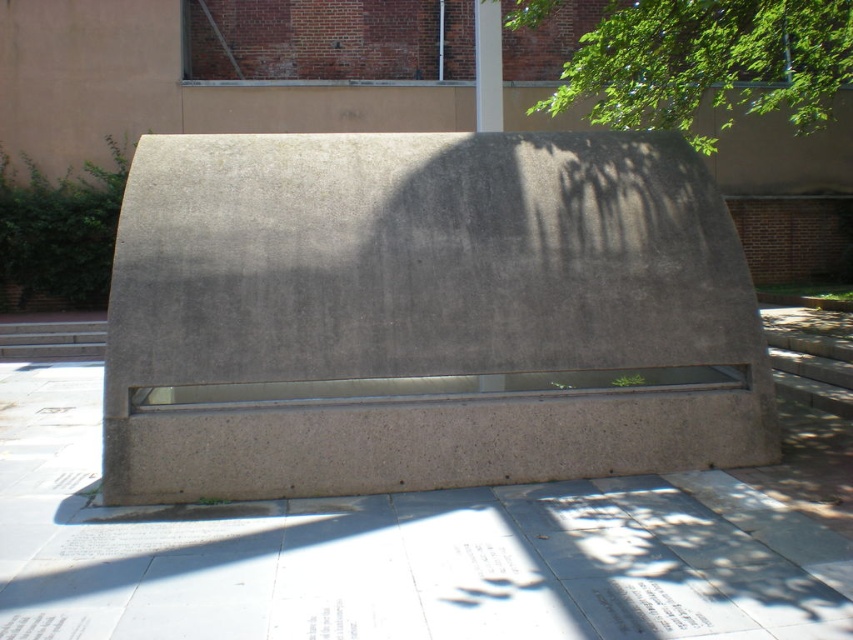
In the scene shown: You are a gardener who wants to water the gray concrete bench at center and the green leafy tree at upper right. Which object is more likely to get wet from the tree when it rains?

The gray concrete bench at center is positioned under green leafy tree at upper right, so it will be more likely to get wet from the tree when it rains.

You are standing on the paved area with light colored tiles and want to walk from the point at coordinates point (328, 451) to the point at coordinates point (688, 28). Since you can only move forward, will you pass in front of or behind the concrete structure during your journey?

Since point (328, 451) is in front of point (688, 28), you will be moving towards the point (688, 28) which is behind the concrete structure. Therefore, you will pass behind the concrete structure during your journey.

You are standing on the paved area and want to move towards the green leafy tree at upper right. Which direction should you walk relative to the gray concrete bench at center?

You should walk to the right of the gray concrete bench at center because the green leafy tree at upper right is positioned on the right side of the bench.